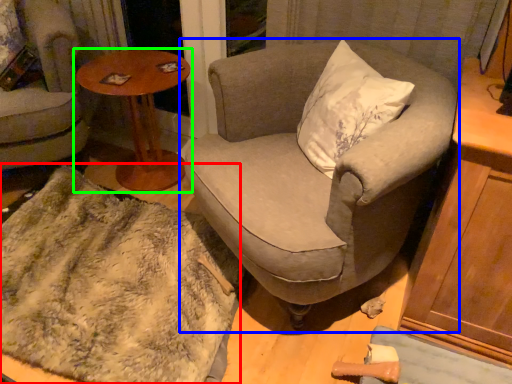
Question: Which object is the farthest from blanket (highlighted by a red box)? Choose among these: chair (highlighted by a blue box) or table (highlighted by a green box).

Choices:
 (A) chair
 (B) table

Answer: (B)